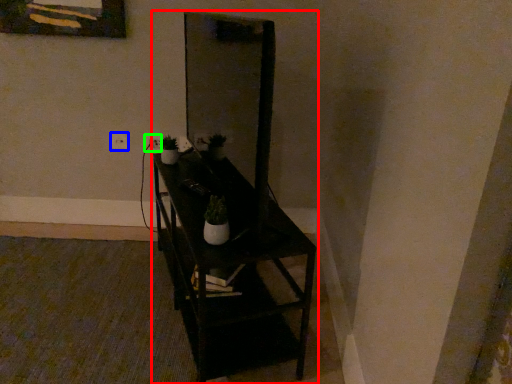
Question: Considering the real-world distances, which object is closest to furniture (highlighted by a red box)? electric outlet (highlighted by a blue box) or electric outlet (highlighted by a green box).

Choices:
 (A) electric outlet
 (B) electric outlet

Answer: (B)